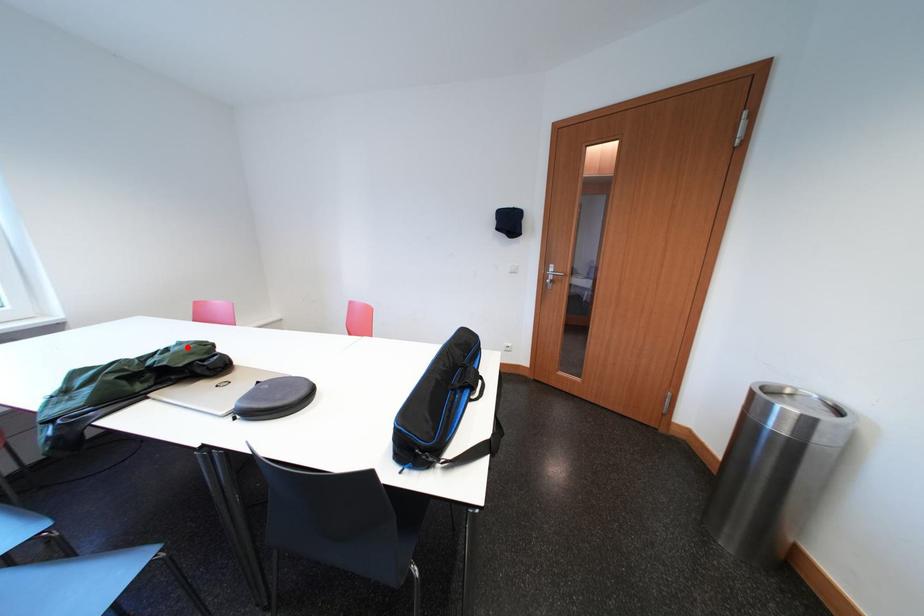
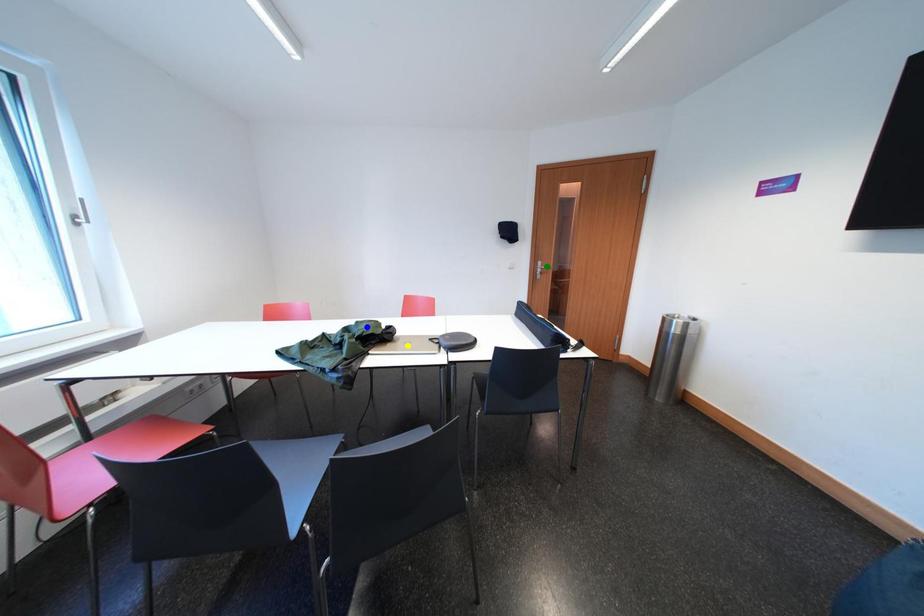
Question: I am providing you with two images of the same scene from different viewpoints. A red point is marked on the first image. You are given multiple points on the second image. In image 2, which mark is for the same physical point as the one in image 1?

Choices:
 (A) green point
 (B) blue point
 (C) yellow point

Answer: (B)